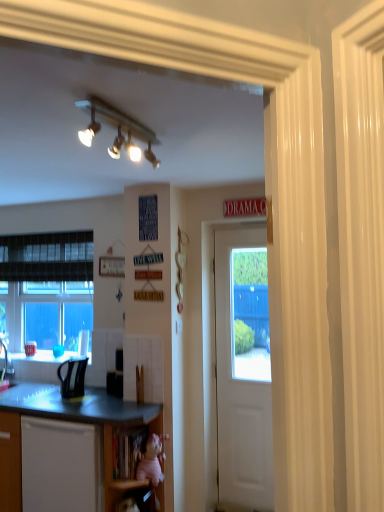
Identify the location of pink plush teddy bear at lower center. (150, 461).

Measure the distance between point (154, 444) and camera.

Point (154, 444) and camera are 2.64 meters apart.

The width and height of the screenshot is (384, 512). Find the location of `black matte microwave oven at lower center`. black matte microwave oven at lower center is located at coordinates (114, 383).

Image resolution: width=384 pixels, height=512 pixels. What do you see at coordinates (72, 377) in the screenshot?
I see `matte black kettle at left` at bounding box center [72, 377].

This screenshot has width=384, height=512. Describe the element at coordinates (108, 455) in the screenshot. I see `pink fabric doll at lower center, acting as the 1th shelf starting from the bottom` at that location.

Locate an element on the screen. The image size is (384, 512). white wooden door at center is located at coordinates (243, 369).

The image size is (384, 512). Identify the location of matte black sink at lower left. (26, 392).

Who is more distant, white glossy track lights at upper center or matte black kettle at left?

Positioned behind is matte black kettle at left.

Is white glossy track lights at upper center far from matte black kettle at left?

Indeed, white glossy track lights at upper center is not near matte black kettle at left.

Is white glossy track lights at upper center positioned with its back to matte black kettle at left?

No, matte black kettle at left is not at the back of white glossy track lights at upper center.

From their relative heights in the image, would you say white glossy track lights at upper center is taller or shorter than matte black kettle at left?

Clearly, white glossy track lights at upper center is shorter compared to matte black kettle at left.

Is pink plush teddy bear at lower center at the right side of black laminate countertop at lower left?

Yes.

Is pink plush teddy bear at lower center thinner than black laminate countertop at lower left?

Correct, the width of pink plush teddy bear at lower center is less than that of black laminate countertop at lower left.

From the image's perspective, is pink plush teddy bear at lower center on black laminate countertop at lower left?

Correct, pink plush teddy bear at lower center appears higher than black laminate countertop at lower left in the image.

Considering the positions of points (150, 436) and (85, 418), is point (150, 436) farther from camera compared to point (85, 418)?

Yes, point (150, 436) is farther from viewer.

Which of these two, matte black sink at lower left or white glossy track lights at upper center, stands taller?

Standing taller between the two is white glossy track lights at upper center.

Considering the relative sizes of matte black sink at lower left and white glossy track lights at upper center in the image provided, is matte black sink at lower left wider than white glossy track lights at upper center?

Correct, the width of matte black sink at lower left exceeds that of white glossy track lights at upper center.

Based on the photo, would you say matte black sink at lower left is a long distance from white glossy track lights at upper center?

Yes.

In the image, is matte black sink at lower left positioned in front of or behind white glossy track lights at upper center?

In the image, matte black sink at lower left appears behind white glossy track lights at upper center.

From a real-world perspective, is black matte microwave oven at lower center positioned above or below pink fabric doll at lower center, acting as the second shelf starting from the top?

Clearly, from a real-world perspective, black matte microwave oven at lower center is above pink fabric doll at lower center, acting as the second shelf starting from the top.

Can you tell me how much black matte microwave oven at lower center and pink fabric doll at lower center, acting as the second shelf starting from the top, differ in facing direction?

They differ by 25.8 degrees in their facing directions.

Which shelf is the 2nd one when counting from the right side of the black matte microwave oven at lower center? Please provide its 2D coordinates.

[(108, 455)]

Which object is positioned more to the right, black matte microwave oven at lower center or pink fabric doll at lower center, acting as the 1th shelf starting from the bottom?

Positioned to the right is pink fabric doll at lower center, acting as the 1th shelf starting from the bottom.

Considering the sizes of wooden at lower center, marked as the first shelf in a top-to-bottom arrangement, and matte black sink at lower left in the image, is wooden at lower center, marked as the first shelf in a top-to-bottom arrangement, wider or thinner than matte black sink at lower left?

In the image, wooden at lower center, marked as the first shelf in a top-to-bottom arrangement, appears to be more narrow than matte black sink at lower left.

Based on the photo, which of these two, wooden at lower center, which is counted as the 2th shelf, starting from the bottom, or matte black sink at lower left, is smaller?

wooden at lower center, which is counted as the 2th shelf, starting from the bottom, is smaller.

From a real-world perspective, is wooden at lower center, which is counted as the 2th shelf, starting from the bottom, physically below matte black sink at lower left?

Correct, in the physical world, wooden at lower center, which is counted as the 2th shelf, starting from the bottom, is lower than matte black sink at lower left.

Relative to matte black sink at lower left, is wooden at lower center, marked as the first shelf in a top-to-bottom arrangement, in front or behind?

wooden at lower center, marked as the first shelf in a top-to-bottom arrangement, is in front of matte black sink at lower left.

Who is bigger, matte black kettle at left or matte black sink at lower left?

matte black sink at lower left is bigger.

In terms of width, does matte black kettle at left look wider or thinner when compared to matte black sink at lower left?

matte black kettle at left is thinner than matte black sink at lower left.

Is matte black kettle at left inside or outside of matte black sink at lower left?

matte black kettle at left lies outside matte black sink at lower left.

Is the position of matte black kettle at left less distant than that of matte black sink at lower left?

No, the depth of matte black kettle at left is greater than that of matte black sink at lower left.

From the image's perspective, is black matte microwave oven at lower center below matte black kettle at left?

Indeed, from the image's perspective, black matte microwave oven at lower center is shown beneath matte black kettle at left.

Are black matte microwave oven at lower center and matte black kettle at left making contact?

No, black matte microwave oven at lower center is not in contact with matte black kettle at left.

Is black matte microwave oven at lower center wider than matte black kettle at left?

In fact, black matte microwave oven at lower center might be narrower than matte black kettle at left.

In the image, is black matte microwave oven at lower center on the left side or the right side of matte black kettle at left?

Based on their positions, black matte microwave oven at lower center is located to the right of matte black kettle at left.

Image resolution: width=384 pixels, height=512 pixels. I want to click on appliance that is behind the white glossy track lights at upper center, so click(x=72, y=377).

The image size is (384, 512). What are the coordinates of `countertop on the left of pink plush teddy bear at lower center` in the screenshot? It's located at (78, 406).

Based on the photo, based on their spatial positions, is black laminate countertop at lower left or white wooden door at center further from pink fabric doll at lower center, acting as the second shelf starting from the top?

white wooden door at center lies further to pink fabric doll at lower center, acting as the second shelf starting from the top, than the other object.

From the picture: Estimate the real-world distances between objects in this image. Which object is closer to white wooden door at center, matte black kettle at left or black matte microwave oven at lower center?

black matte microwave oven at lower center.

Estimate the real-world distances between objects in this image. Which object is further from pink fabric doll at lower center, acting as the 1th shelf starting from the bottom, black laminate countertop at lower left or matte black kettle at left?

matte black kettle at left is positioned further to the anchor pink fabric doll at lower center, acting as the 1th shelf starting from the bottom.

Which object lies nearer to the anchor point black laminate countertop at lower left, white glossy track lights at upper center or pink plush teddy bear at lower center?

Based on the image, pink plush teddy bear at lower center appears to be nearer to black laminate countertop at lower left.

Estimate the real-world distances between objects in this image. Which object is further from wooden at lower center, which is counted as the 2th shelf, starting from the bottom, white wooden door at center or matte black sink at lower left?

The object further to wooden at lower center, which is counted as the 2th shelf, starting from the bottom, is white wooden door at center.

When comparing their distances from pink plush teddy bear at lower center, does black matte microwave oven at lower center or black laminate countertop at lower left seem closer?

black matte microwave oven at lower center is closer to pink plush teddy bear at lower center.

Considering their positions, is pink fabric doll at lower center, acting as the second shelf starting from the top, positioned further to white wooden door at center than white glossy track lights at upper center?

Based on the image, white glossy track lights at upper center appears to be further to white wooden door at center.

Considering their positions, is pink plush teddy bear at lower center positioned closer to black matte microwave oven at lower center than matte black sink at lower left?

pink plush teddy bear at lower center is positioned closer to the anchor black matte microwave oven at lower center.

You are a GUI agent. You are given a task and a screenshot of the screen. Output one action in this format:
    pyautogui.click(x=<x>, y=<y>)
    Task: Click on the sink between white glossy track lights at upper center and pink plush teddy bear at lower center in the vertical direction
    This screenshot has width=384, height=512.
    Given the screenshot: What is the action you would take?
    pyautogui.click(x=26, y=392)

Where is `appliance located between white glossy track lights at upper center and black matte microwave oven at lower center in the depth direction`? Image resolution: width=384 pixels, height=512 pixels. appliance located between white glossy track lights at upper center and black matte microwave oven at lower center in the depth direction is located at coordinates (72, 377).

The image size is (384, 512). Identify the location of teddy bear between white glossy track lights at upper center and black laminate countertop at lower left in the vertical direction. [x=150, y=461].

Identify the location of microwave oven between matte black sink at lower left and white wooden door at center. The width and height of the screenshot is (384, 512). (114, 383).